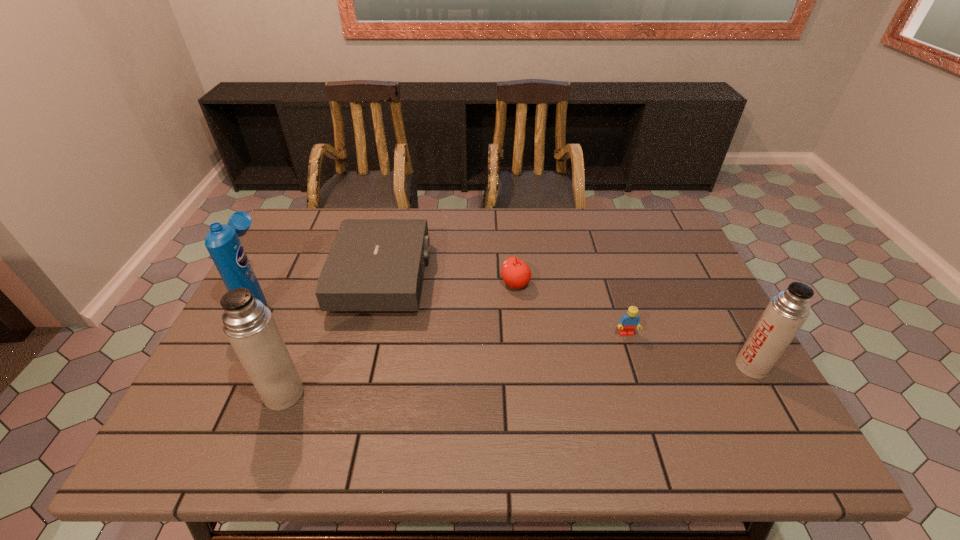
Where is `the taller thermos bottle`? the taller thermos bottle is located at coordinates (249, 325).

This screenshot has height=540, width=960. In order to click on the shorter thermos bottle in this screenshot , I will do `click(786, 313)`.

This screenshot has width=960, height=540. What are the coordinates of `the right thermos bottle` in the screenshot? It's located at (786, 313).

You are a GUI agent. You are given a task and a screenshot of the screen. Output one action in this format:
    pyautogui.click(x=<x>, y=<y>)
    Task: Click on the projector
    The image size is (960, 540).
    Given the screenshot: What is the action you would take?
    pyautogui.click(x=374, y=264)

Where is `the third nearest object`? the third nearest object is located at coordinates (628, 322).

This screenshot has height=540, width=960. I want to click on Lego, so (x=628, y=322).

Find the location of a particular element. The image size is (960, 540). the leftmost object is located at coordinates (222, 241).

The image size is (960, 540). Find the location of `apple`. apple is located at coordinates (516, 274).

Identify the location of vacant space located 0.250m on the right of the taller thermos bottle. This screenshot has height=540, width=960. (417, 394).

Locate an element on the screen. The image size is (960, 540). vacant region located 0.150m on the back of the shorter thermos bottle is located at coordinates (720, 309).